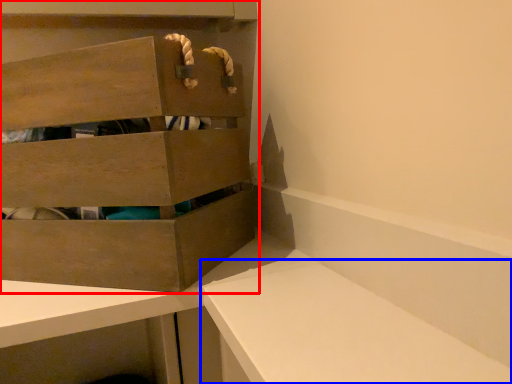
Question: Which object is further to the camera taking this photo, cabinetry (highlighted by a red box) or vanity (highlighted by a blue box)?

Choices:
 (A) cabinetry
 (B) vanity

Answer: (A)